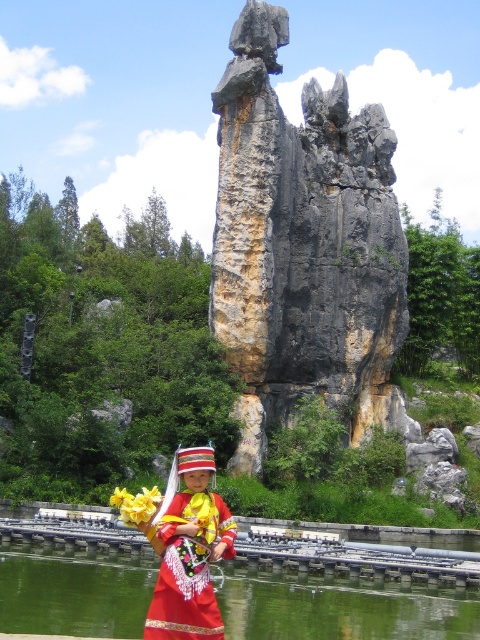
Question: Which object appears closest to the camera in this image?

Choices:
 (A) red satin dress at center
 (B) yellow fabric flower at lower center

Answer: (A)

Question: Among these points, which one is farthest from the camera?

Choices:
 (A) (202, 490)
 (B) (296, 243)
 (C) (286, 621)
 (D) (115, 492)

Answer: (B)

Question: Which point is farther from the camera taking this photo?

Choices:
 (A) (177, 472)
 (B) (301, 204)
 (C) (476, 632)
 (D) (137, 520)

Answer: (B)

Question: Does green smooth water at lower center lie behind yellow fabric flower at lower center?

Choices:
 (A) no
 (B) yes

Answer: (B)

Question: Does rough gray rock at center appear under red satin dress at center?

Choices:
 (A) no
 (B) yes

Answer: (A)

Question: Observing the image, what is the correct spatial positioning of rough gray rock at center in reference to red satin dress at center?

Choices:
 (A) above
 (B) below

Answer: (A)